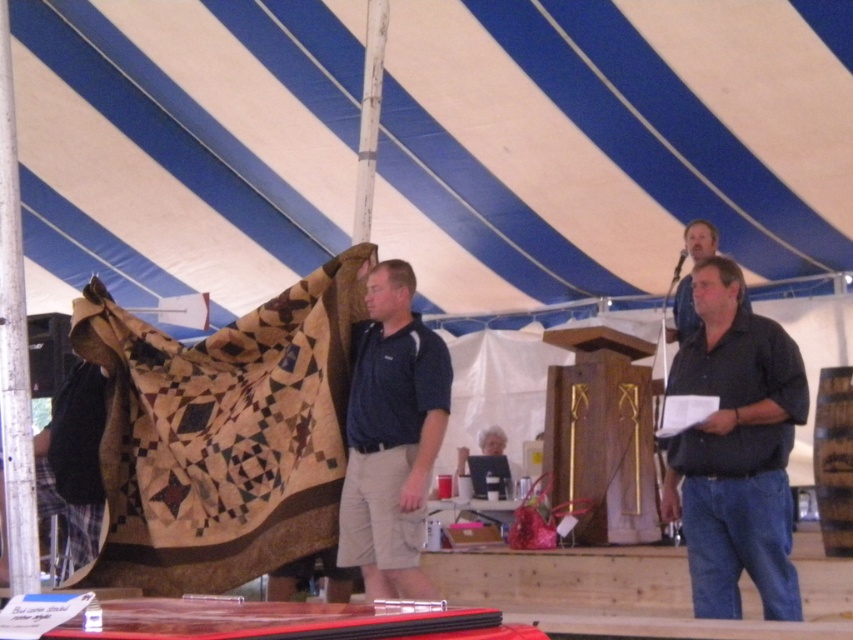
Which of these two, blue and white striped canopy at upper center or dark brown leather jacket at upper right, stands shorter?

With less height is dark brown leather jacket at upper right.

From the picture: Does blue and white striped canopy at upper center come in front of dark brown leather jacket at upper right?

No, blue and white striped canopy at upper center is behind dark brown leather jacket at upper right.

Which is in front, point (173, 196) or point (700, 248)?

Point (700, 248) is in front.

At what (x,y) coordinates should I click in order to perform the action: click on blue and white striped canopy at upper center. Please return your answer as a coordinate pair (x, y). Looking at the image, I should click on (610, 141).

Looking at this image, is dark blue cotton polo shirt at center positioned at the back of dark brown leather jacket at upper right?

No.

Which is more to the left, dark blue cotton polo shirt at center or dark brown leather jacket at upper right?

dark blue cotton polo shirt at center

Between point (434, 449) and point (695, 230), which one is positioned in front?

Point (434, 449) is in front.

The height and width of the screenshot is (640, 853). Identify the location of dark blue cotton polo shirt at center. (392, 436).

Can you confirm if quilted fabric at center is thinner than dark brown leather jacket at upper right?

No, quilted fabric at center is not thinner than dark brown leather jacket at upper right.

Is quilted fabric at center taller than dark brown leather jacket at upper right?

Yes.

You are a GUI agent. You are given a task and a screenshot of the screen. Output one action in this format:
    pyautogui.click(x=<x>, y=<y>)
    Task: Click on the quilted fabric at center
    
    Given the screenshot: What is the action you would take?
    pyautogui.click(x=222, y=435)

Find the location of a particular element. This screenshot has width=853, height=640. quilted fabric at center is located at coordinates (222, 435).